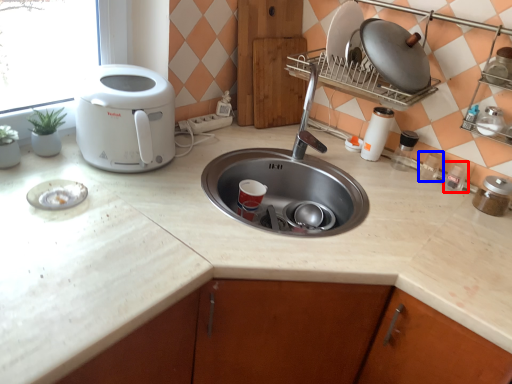
Question: Which point is further to the camera, appliance (highlighted by a red box) or appliance (highlighted by a blue box)?

Choices:
 (A) appliance
 (B) appliance

Answer: (B)